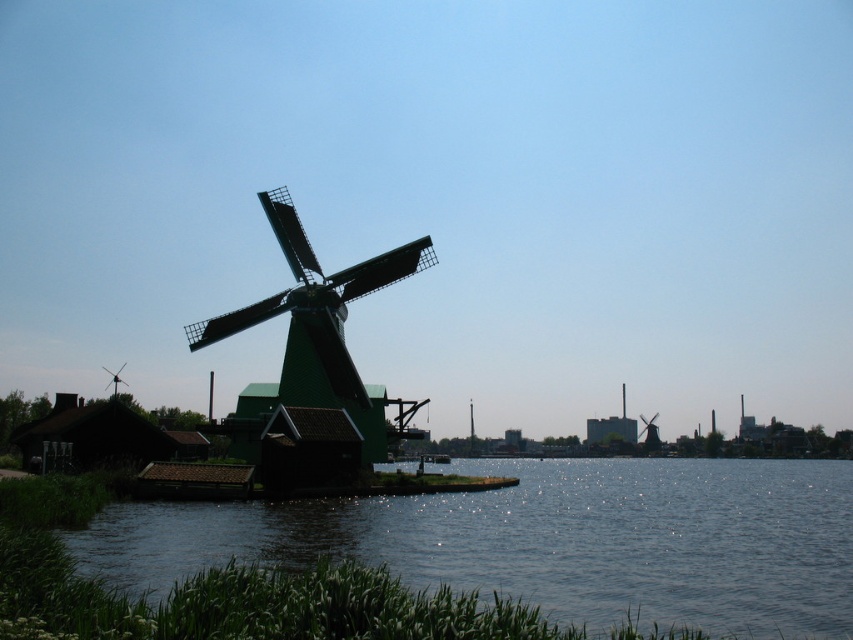
Is green smooth water at lower left smaller than green matte windmill at center?

Actually, green smooth water at lower left might be larger than green matte windmill at center.

Identify the location of green smooth water at lower left. Image resolution: width=853 pixels, height=640 pixels. (547, 540).

This screenshot has width=853, height=640. What are the coordinates of `green smooth water at lower left` in the screenshot? It's located at (547, 540).